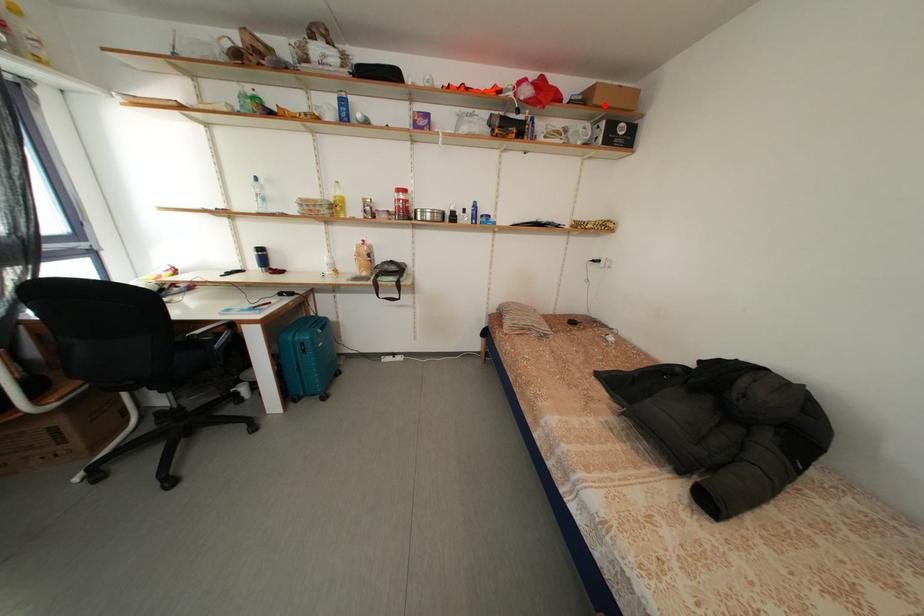
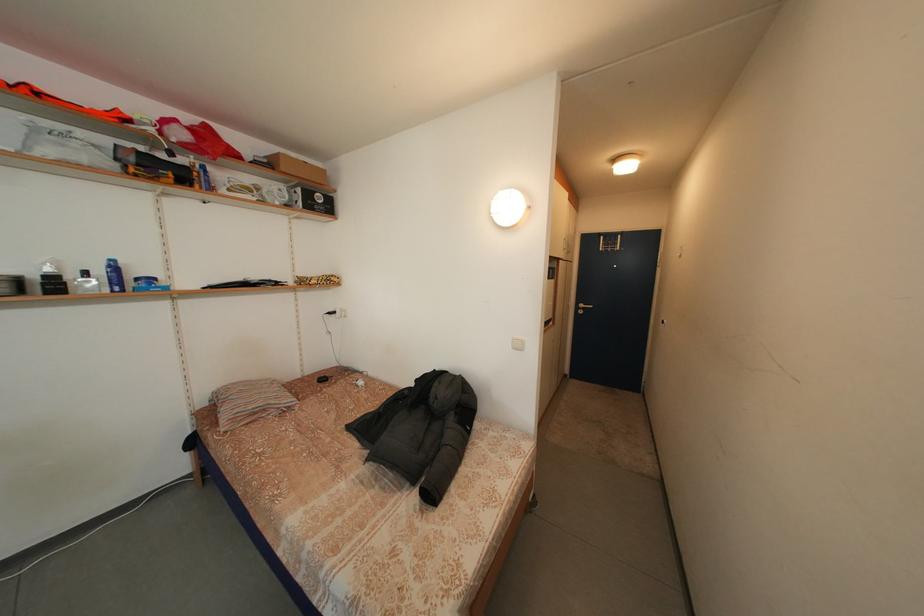
Where in the second image is the point corresponding to the highlighted location from the first image?

(292, 175)